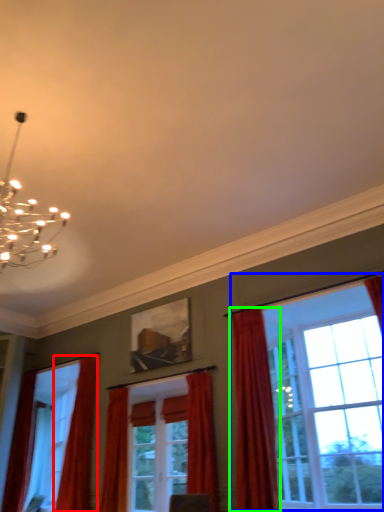
Question: Which object is the closest to the curtain (highlighted by a red box)? Choose among these: window (highlighted by a blue box) or curtain (highlighted by a green box).

Choices:
 (A) window
 (B) curtain

Answer: (A)